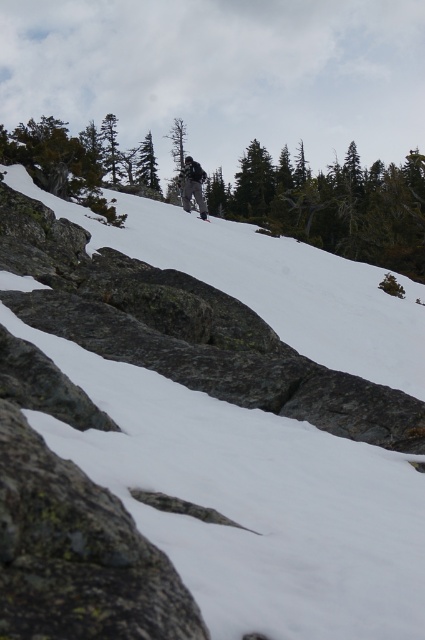
From the picture: You are a hiker trying to locate the black matte ski at upper center. From your position at the white powdery snow at center, which direction should you move to find the ski?

The black matte ski at upper center is to the left of the white powdery snow at center, so you should move to the left to find it.

You are a photographer trying to capture the dark gray ski pants at center and the black matte ski at upper center in the same frame. Based on their heights, which object will appear larger in the photo?

The dark gray ski pants at center has a greater height compared to the black matte ski at upper center, so it will appear larger in the photo.